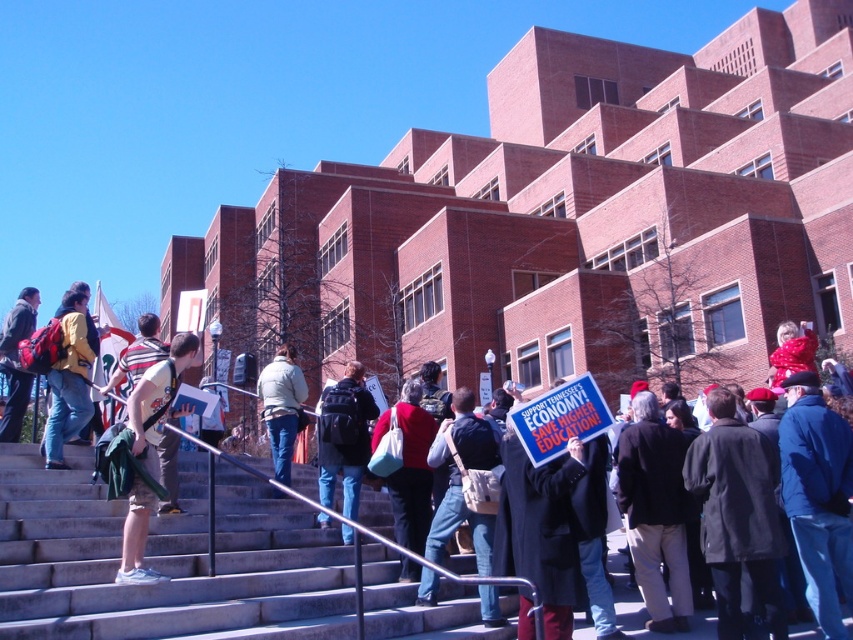
You are standing on the stairs looking towards the large brick building. There are two points marked on the stairs. Which point is closer to you, point (86, 369) or point (28, 392)?

Point (86, 369) is closer to you than point (28, 392).

You are a photographer standing at the bottom of the gray concrete stairs at center. You want to take a photo of the matte yellow jacket at center. Which direction should you move to get a better shot?

Since the gray concrete stairs at center is closer to the viewer than the matte yellow jacket at center, you should move forward towards the stairs to get a better shot of the matte yellow jacket at center.